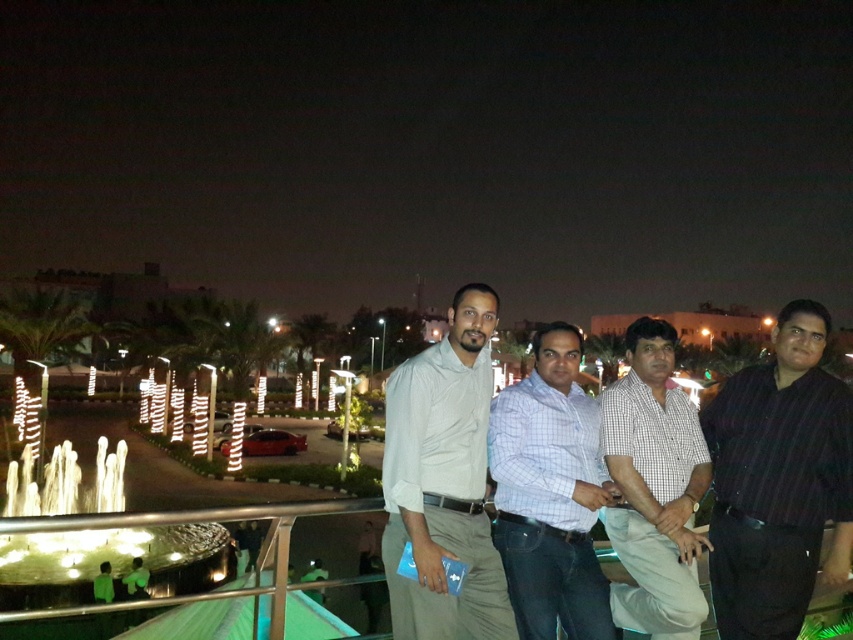
What do you see at coordinates (549, 493) in the screenshot? This screenshot has width=853, height=640. I see `light blue checkered shirt at center` at bounding box center [549, 493].

Looking at this image, is light blue checkered shirt at center bigger than checkered fabric shirt at center?

Incorrect, light blue checkered shirt at center is not larger than checkered fabric shirt at center.

Is point (587, 406) less distant than point (608, 534)?

No, it is not.

Image resolution: width=853 pixels, height=640 pixels. I want to click on light blue checkered shirt at center, so click(x=549, y=493).

Can you confirm if dark striped shirt at right is wider than white cotton shirt at center?

Incorrect, dark striped shirt at right's width does not surpass white cotton shirt at center's.

Is dark striped shirt at right positioned at the back of white cotton shirt at center?

Yes, dark striped shirt at right is further from the viewer.

This screenshot has height=640, width=853. What do you see at coordinates (778, 481) in the screenshot?
I see `dark striped shirt at right` at bounding box center [778, 481].

Where is `dark striped shirt at right`? Image resolution: width=853 pixels, height=640 pixels. dark striped shirt at right is located at coordinates (778, 481).

Who is lower down, dark striped shirt at right or checkered fabric shirt at center?

checkered fabric shirt at center

This screenshot has width=853, height=640. Describe the element at coordinates (778, 481) in the screenshot. I see `dark striped shirt at right` at that location.

Locate an element on the screen. Image resolution: width=853 pixels, height=640 pixels. dark striped shirt at right is located at coordinates (778, 481).